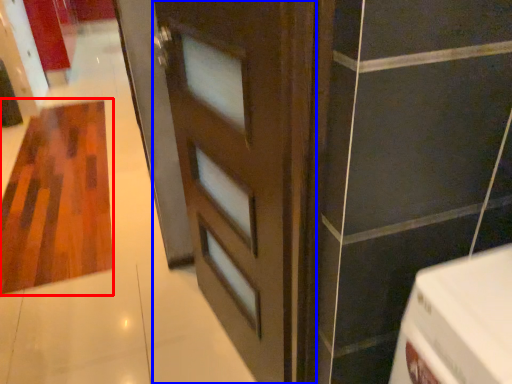
Question: Which object appears farthest to the camera in this image, hardwood (highlighted by a red box) or door (highlighted by a blue box)?

Choices:
 (A) hardwood
 (B) door

Answer: (A)